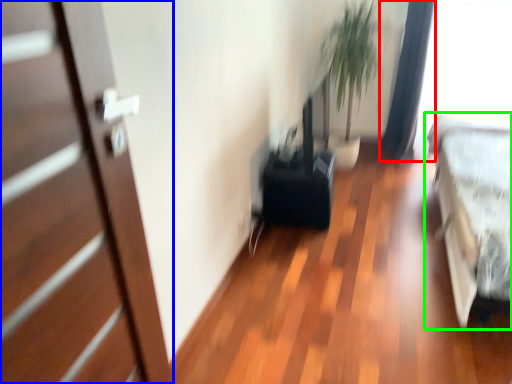
Question: Considering the real-world distances, which object is farthest from curtain (highlighted by a red box)? door (highlighted by a blue box) or bed (highlighted by a green box)?

Choices:
 (A) door
 (B) bed

Answer: (A)